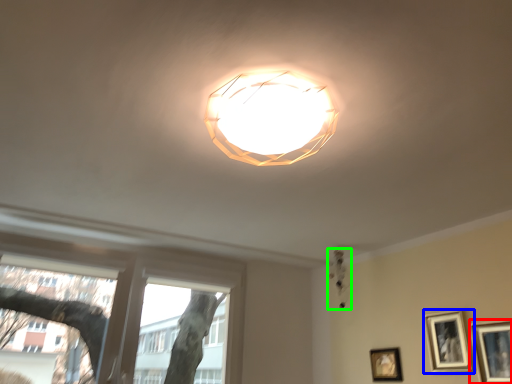
Question: Estimate the real-world distances between objects in this image. Which object is farther from picture frame (highlighted by a red box), picture frame (highlighted by a blue box) or lamp (highlighted by a green box)?

Choices:
 (A) picture frame
 (B) lamp

Answer: (B)